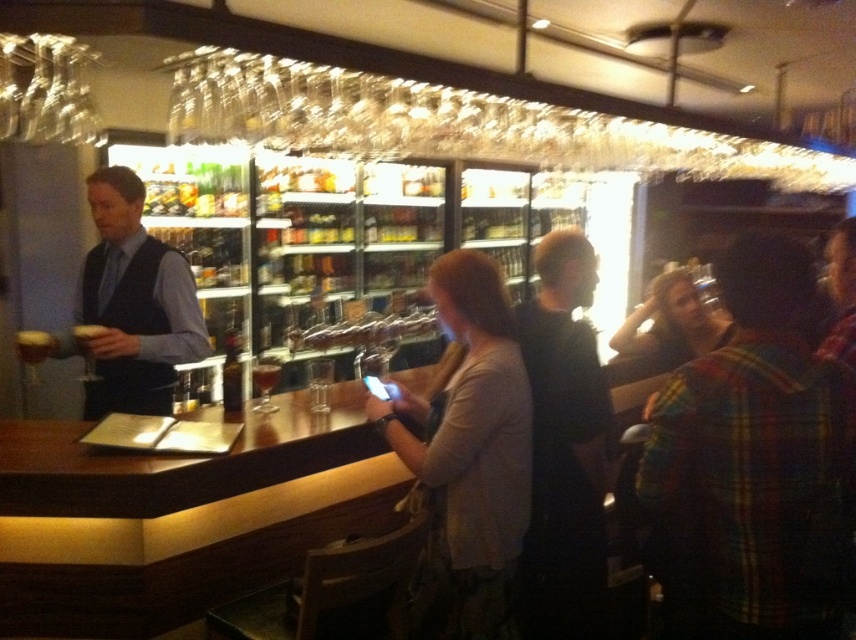
Who is taller, black matte shirt at center or transparent glass at bar?

black matte shirt at center is taller.

Can you confirm if black matte shirt at center is positioned above transparent glass at bar?

Incorrect, black matte shirt at center is not positioned above transparent glass at bar.

Describe the element at coordinates (563, 445) in the screenshot. The height and width of the screenshot is (640, 856). I see `black matte shirt at center` at that location.

The image size is (856, 640). I want to click on black matte shirt at center, so click(x=563, y=445).

Between translucent glass wine glass at bar left and transparent glass at bar, which one has less height?

transparent glass at bar

How distant is translucent glass wine glass at bar left from transparent glass at bar?

They are 1.49 meters apart.

Which is behind, point (28, 336) or point (321, 368)?

Point (321, 368)

Where is `translucent glass wine glass at bar left`? translucent glass wine glass at bar left is located at coordinates (33, 349).

Between translucent glass wine glass at bar left and translucent glass at bar center, which one is positioned higher?

translucent glass at bar center is higher up.

This screenshot has width=856, height=640. Describe the element at coordinates (33, 349) in the screenshot. I see `translucent glass wine glass at bar left` at that location.

The width and height of the screenshot is (856, 640). I want to click on translucent glass wine glass at bar left, so click(x=33, y=349).